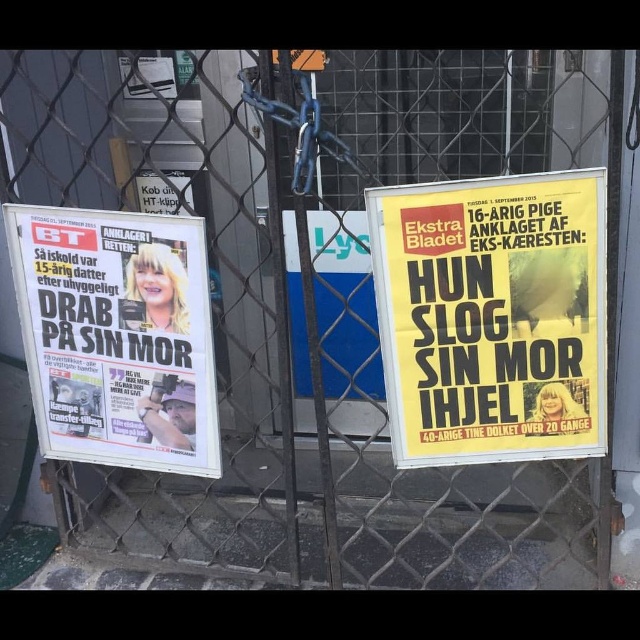
Question: Among these objects, which one is farthest from the camera?

Choices:
 (A) yellow paper poster at right
 (B) white glossy poster at left

Answer: (B)

Question: Can you confirm if yellow paper poster at right is smaller than white glossy poster at left?

Choices:
 (A) no
 (B) yes

Answer: (B)

Question: Does yellow paper poster at right appear under white glossy poster at left?

Choices:
 (A) yes
 (B) no

Answer: (B)

Question: Which point is farther to the camera?

Choices:
 (A) white glossy poster at left
 (B) yellow paper poster at right

Answer: (A)

Question: Is yellow paper poster at right smaller than white glossy poster at left?

Choices:
 (A) no
 (B) yes

Answer: (B)

Question: Which point is closer to the camera taking this photo?

Choices:
 (A) (474, 312)
 (B) (164, 344)

Answer: (A)